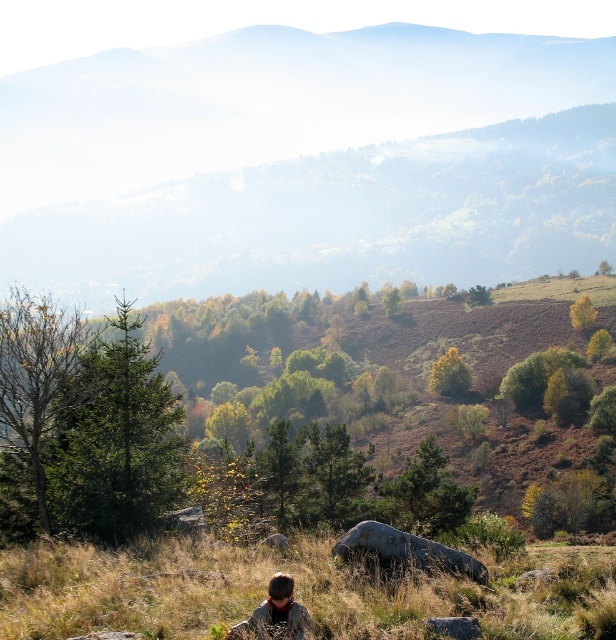
Question: Which object is the farthest from the green leafy hillside at center?

Choices:
 (A) green grass at lower center
 (B) brown hair at lower center

Answer: (A)

Question: Which object is closer to the camera taking this photo?

Choices:
 (A) green leafy hillside at center
 (B) brown hair at lower center

Answer: (B)

Question: Is green grass at lower center below gray rough rock at center?

Choices:
 (A) yes
 (B) no

Answer: (A)

Question: Which of these objects is positioned farthest from the brown hair at lower center?

Choices:
 (A) green grass at lower center
 (B) gray rough rock at center
 (C) green leafy hillside at center

Answer: (C)

Question: Does green leafy hillside at center appear on the left side of gray rough rock at center?

Choices:
 (A) no
 (B) yes

Answer: (A)

Question: Is green leafy hillside at center further to the viewer compared to brown hair at lower center?

Choices:
 (A) no
 (B) yes

Answer: (B)